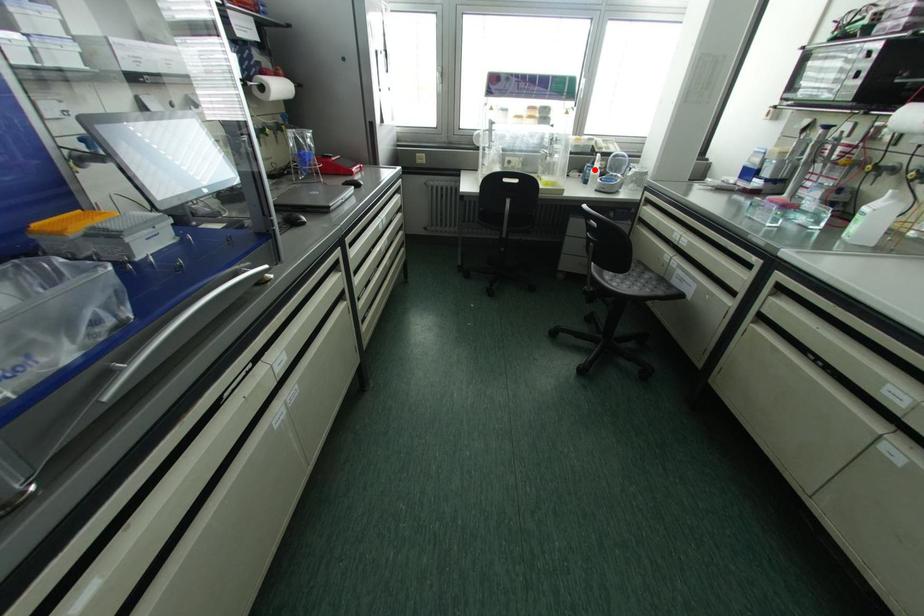
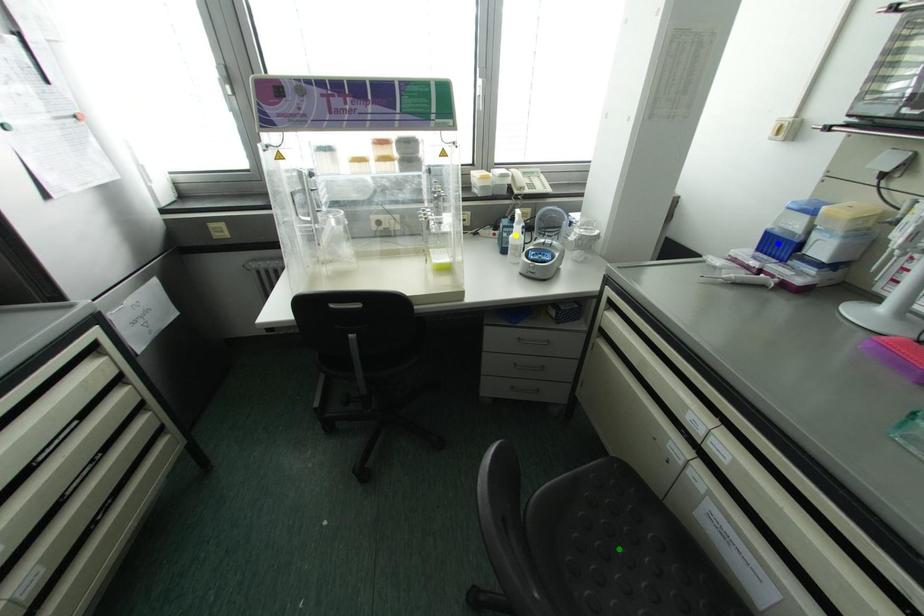
Question: I am providing you with two images of the same scene from different viewpoints. A red point is marked on the first image. You are given multiple points on the second image. Can you choose the point in image 2 that corresponds to the point in image 1?

Choices:
 (A) blue point
 (B) yellow point
 (C) green point

Answer: (B)